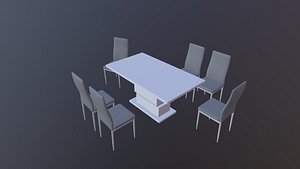
Locate an element on the screen. The image size is (300, 169). chair is located at coordinates click(x=210, y=107).